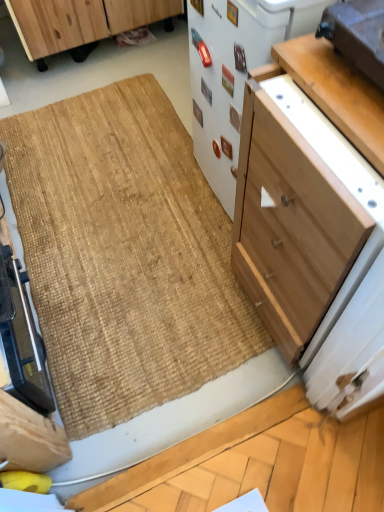
This screenshot has height=512, width=384. What are the coordinates of `empty space that is ontop of natural fiber doormat at center (from a real-world perspective)` in the screenshot? It's located at (125, 218).